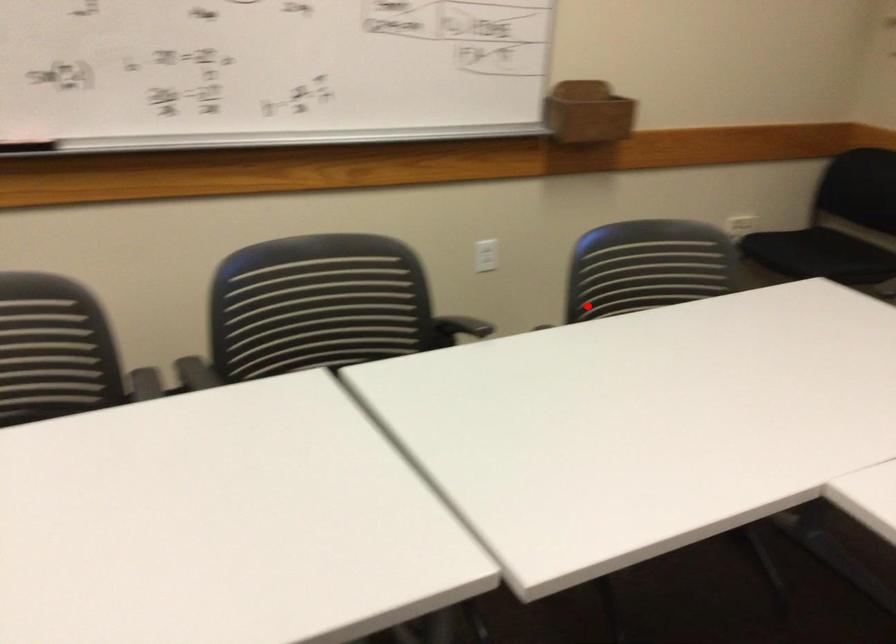
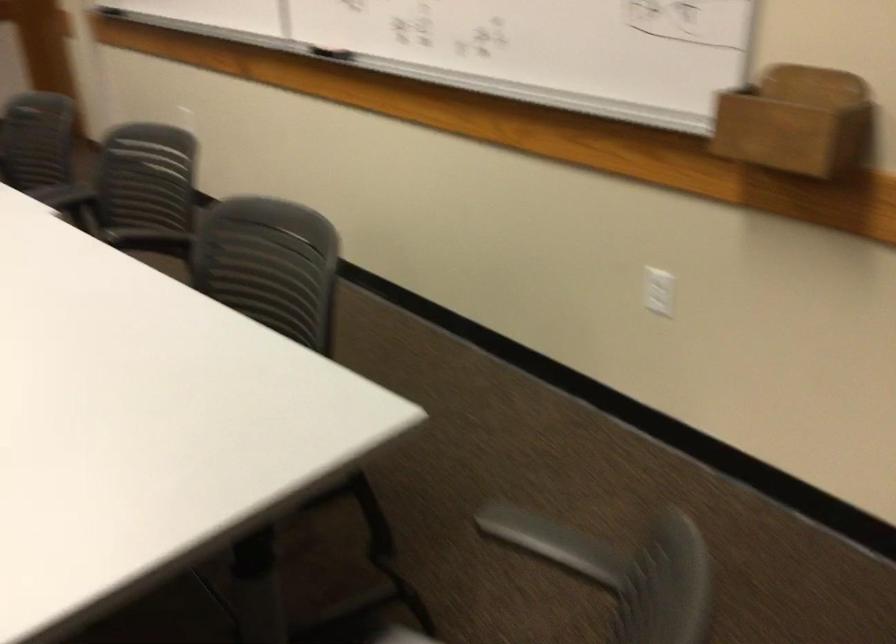
Locate, in the second image, the point that corresponds to the highlighted location in the first image.

(270, 289)